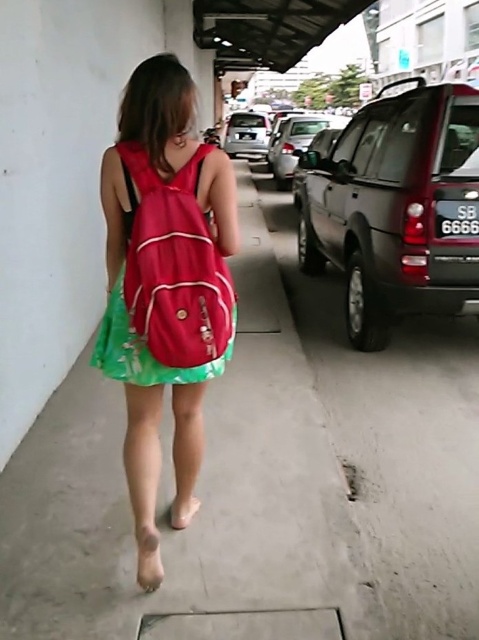
You are standing on the street and want to walk towards the point that is closer to you. Which point should you head towards, point [363,344] or point [264,138]?

You should head towards point [363,344] because it is closer to the viewer than point [264,138].

You are standing at the center of the image and want to walk to the dark gray metallic suv at right. Which direction should you move in to reach it?

The dark gray metallic suv at right is located at the right side of the image, so you should move to the right to reach it.

You are a delivery person trying to park your van in the parking lot. You see the dark gray metallic suv at right and the green satin dress at center. Which object takes up more horizontal space in the image?

The green satin dress at center takes up more horizontal space because the dark gray metallic suv at right is narrower than it.